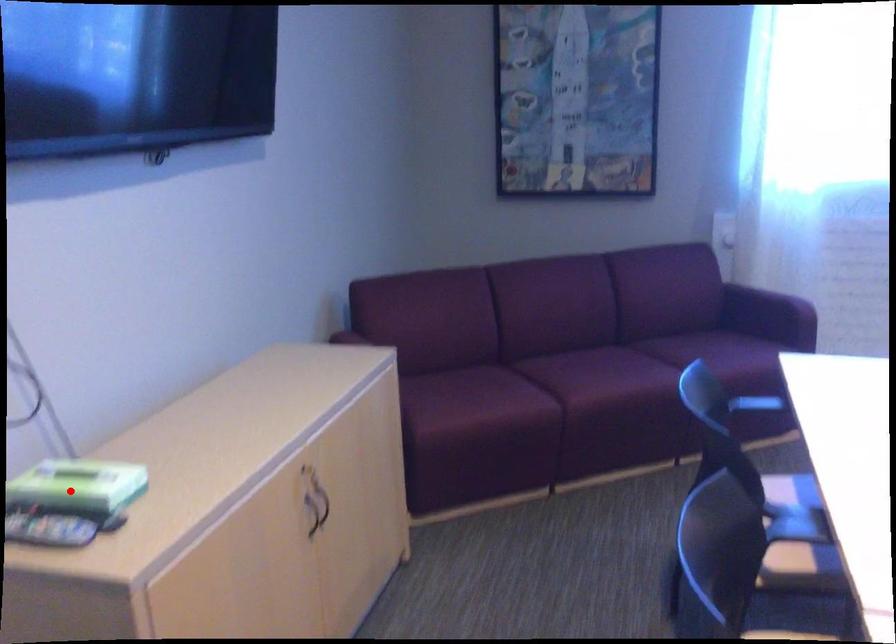
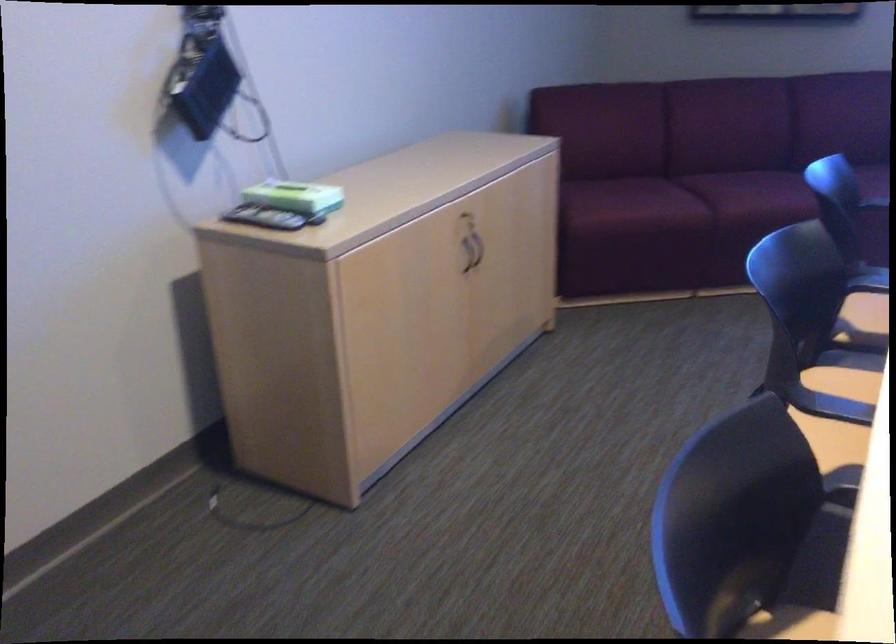
Locate, in the second image, the point that corresponds to the highlighted location in the first image.

(287, 196)